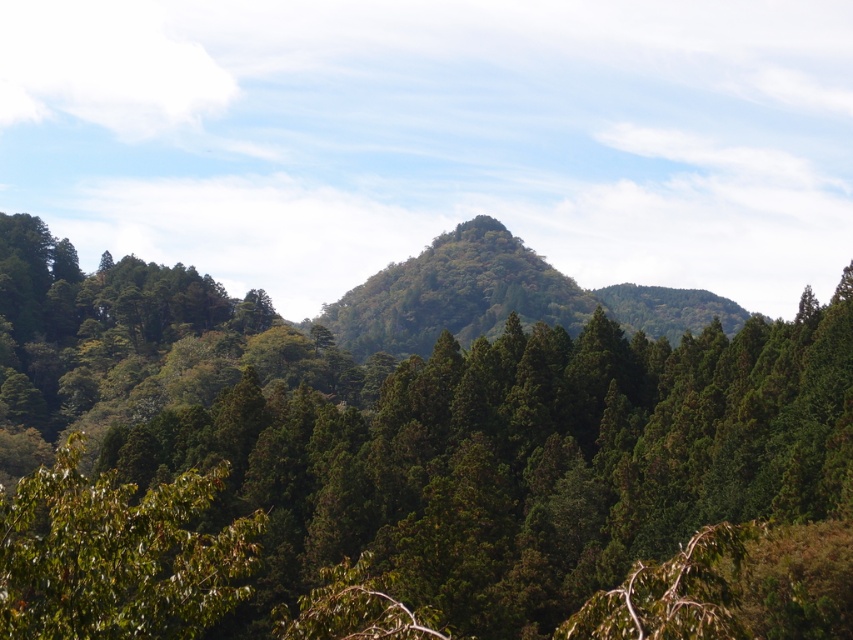
Is green textured tree at center shorter than green textured hillside at center?

In fact, green textured tree at center may be taller than green textured hillside at center.

What do you see at coordinates (433, 435) in the screenshot? I see `green textured tree at center` at bounding box center [433, 435].

Who is more forward, (648, 461) or (548, 272)?

Point (648, 461)

In order to click on green textured tree at center in this screenshot , I will do coord(433,435).

Is point (590, 573) farther from viewer compared to point (44, 513)?

Yes, point (590, 573) is farther from viewer.

Who is lower down, green textured tree at center or green matte tree at lower left?

green matte tree at lower left is below.

Is point (706, 433) in front of point (154, 499)?

No, (706, 433) is further to viewer.

Identify the location of green textured tree at center. (433, 435).

Between green matte tree at lower left and green textured hillside at center, which one is positioned lower?

green matte tree at lower left

Is green matte tree at lower left shorter than green textured hillside at center?

Indeed, green matte tree at lower left has a lesser height compared to green textured hillside at center.

Which is behind, point (9, 541) or point (492, 253)?

Positioned behind is point (492, 253).

I want to click on green matte tree at lower left, so click(115, 556).